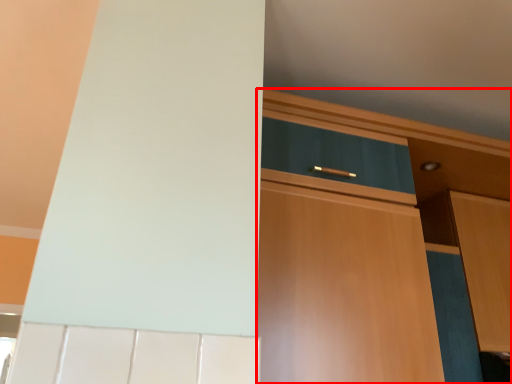
Question: From the image's perspective, where is cabinetry (annotated by the red box) located in relation to cabinetry in the image?

Choices:
 (A) above
 (B) below

Answer: (A)